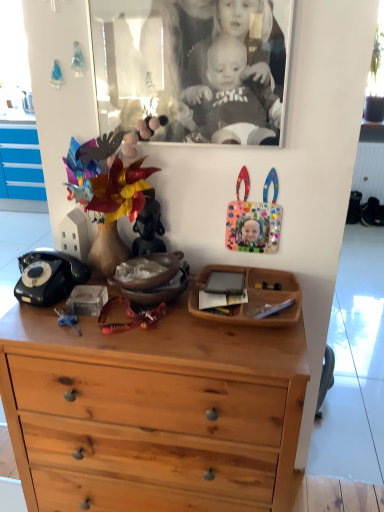
I want to click on vacant space that is to the left of matte ceramic vase at center, placed as the first toy when sorted from left to right, so [85, 288].